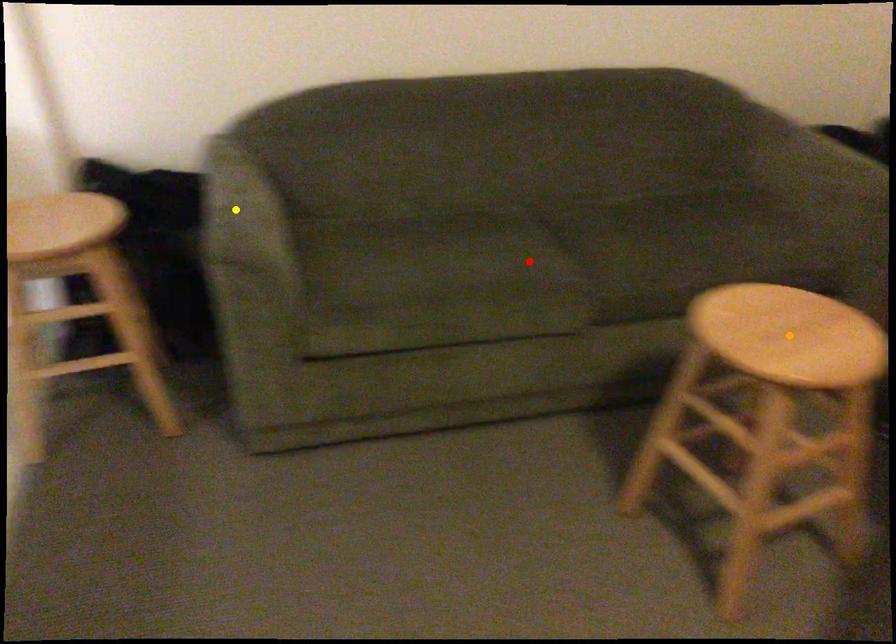
Based on the photo, order these from nearest to farthest:
yellow point
orange point
red point

orange point, yellow point, red point